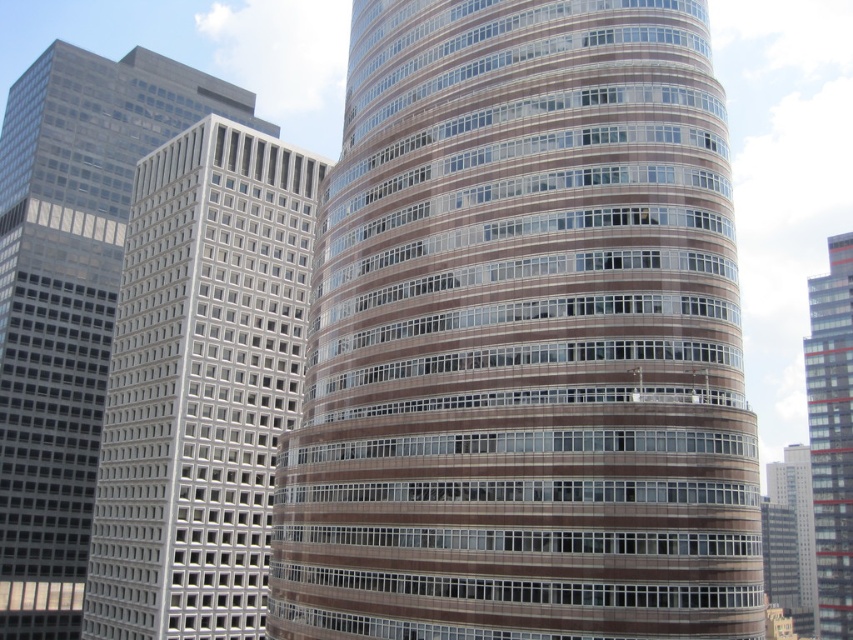
You are an architect examining the skyscrapers. Which building is positioned higher in the image, the white glass building at center or the red glass building at right?

The white glass building at center is located above the red glass building at right, so it is positioned higher in the image.

You are an architect evaluating the skyline of a city. You notice two prominent buildings in the scene. The white glass building at center and the red glass building at right. Which building would cast a shorter shadow during midday when the sun is directly overhead?

The white glass building at center has a lesser height compared to the red glass building at right. Since the height of the building directly affects the length of its shadow, the white glass building at center would cast a shorter shadow during midday when the sun is directly overhead.